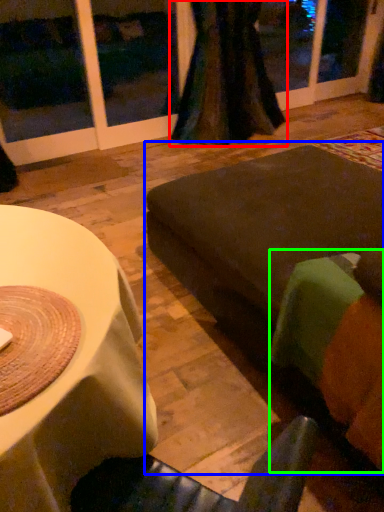
Question: Which is farther away from curtain (highlighted by a red box)? couch (highlighted by a blue box) or couch (highlighted by a green box)?

Choices:
 (A) couch
 (B) couch

Answer: (B)